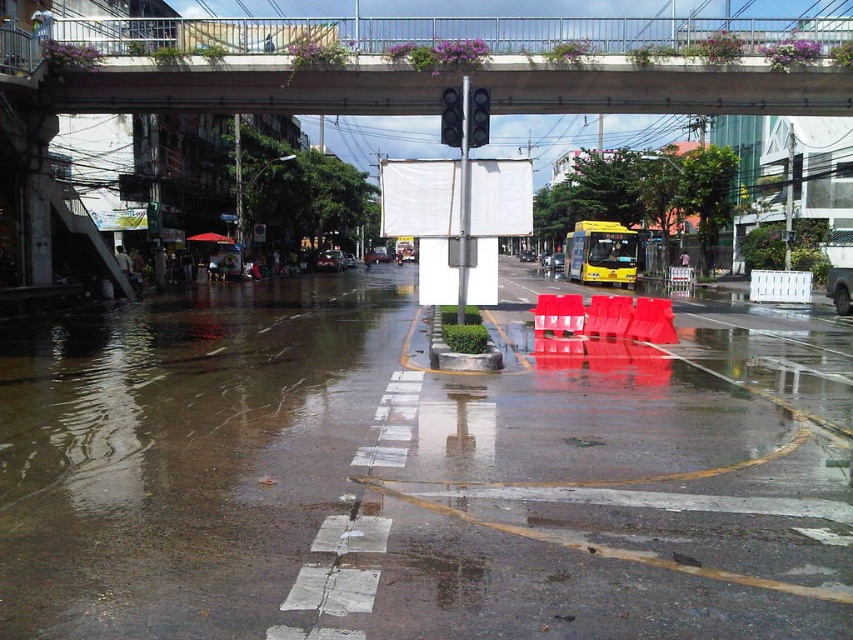
Does point (474, 109) come closer to viewer compared to point (451, 99)?

Yes.

Does point (479, 132) come farther from viewer compared to point (456, 102)?

No, (479, 132) is closer to viewer.

Who is more forward, (x=469, y=92) or (x=462, y=116)?

Point (x=462, y=116)

Locate an element on the screen. black glass traffic light at upper center is located at coordinates (479, 116).

Does yellow matte school bus at center appear on the left side of black glass traffic light at upper center?

No, yellow matte school bus at center is not to the left of black glass traffic light at upper center.

In the scene shown: Can you confirm if yellow matte school bus at center is bigger than black glass traffic light at upper center?

Yes.

You are a GUI agent. You are given a task and a screenshot of the screen. Output one action in this format:
    pyautogui.click(x=<x>, y=<y>)
    Task: Click on the yellow matte school bus at center
    The height and width of the screenshot is (640, 853).
    Given the screenshot: What is the action you would take?
    pyautogui.click(x=601, y=253)

Who is positioned more to the left, brown concrete flood at lower left or yellow matte school bus at center?

brown concrete flood at lower left

Between brown concrete flood at lower left and yellow matte school bus at center, which one has more height?

With more height is yellow matte school bus at center.

Does point (137, 424) lie behind point (635, 260)?

No, it is in front of (635, 260).

Where is `brown concrete flood at lower left`? The height and width of the screenshot is (640, 853). brown concrete flood at lower left is located at coordinates (199, 460).